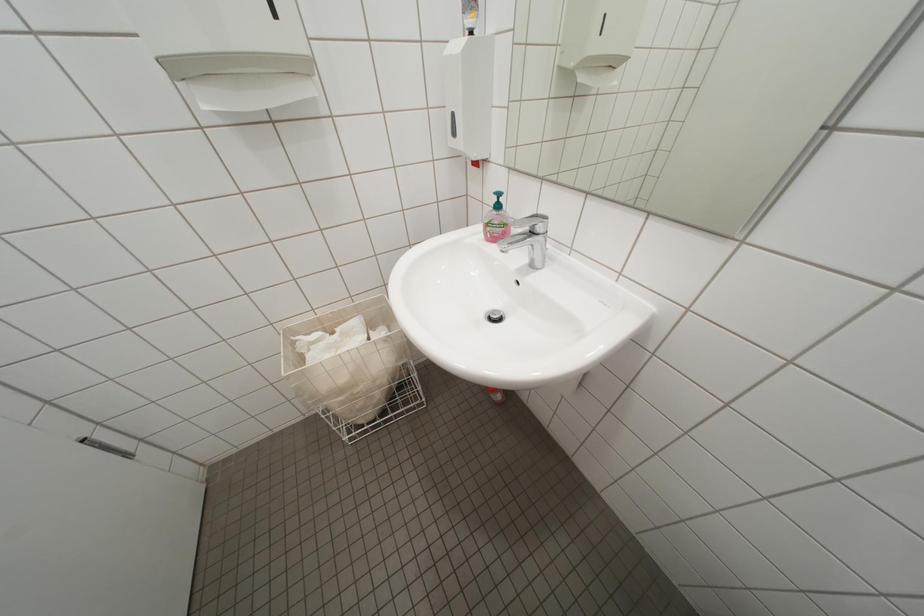
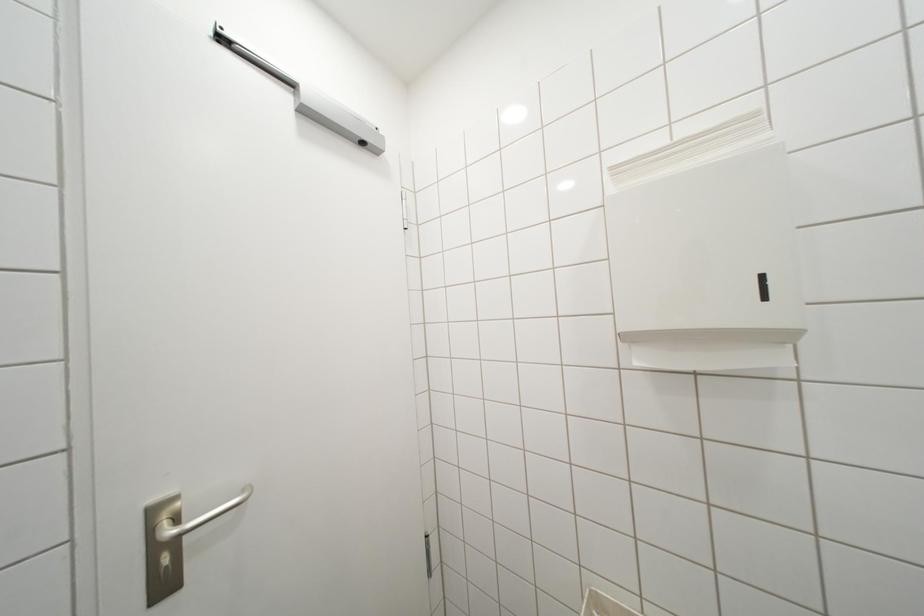
Question: Based on the continuous images, in which direction is the camera rotating? Reply with the corresponding letter.

Choices:
 (A) Left
 (B) Right
 (C) Up
 (D) Down

Answer: (A)